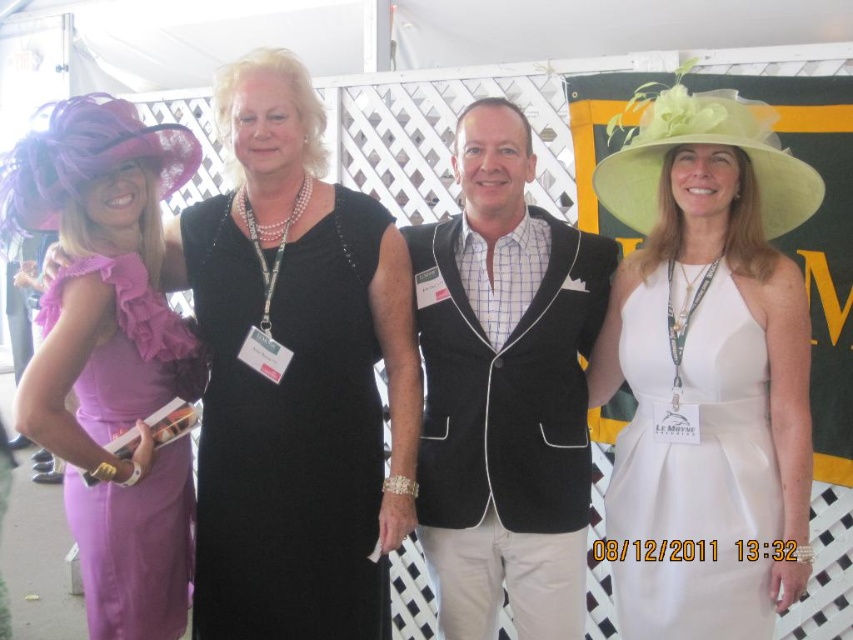
You are at a formal event and want to take a photo of the matte purple dress at left and the ruffled satin dress at left. Which dress is closer to the camera?

The matte purple dress at left is closer to the camera than the ruffled satin dress at left.

You are a photographer at the event and want to capture both the matte purple dress at left and the ruffled satin dress at left in a single frame. Which dress should you focus on first to ensure both are in the shot?

The ruffled satin dress at left should be focused on first because the matte purple dress at left is positioned to its right, meaning the ruffled satin dress is closer to the left edge of the frame. By starting with the ruffled satin dress at left, you can ensure both dresses are included in the shot.